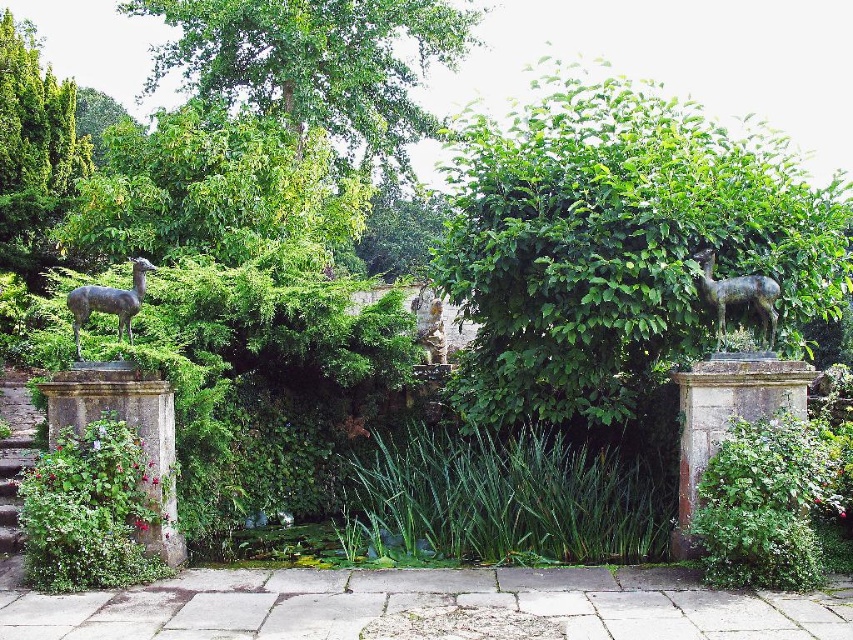
You are a gardener who needs to prune the green leafy tree at upper center and the bronze statue at left. Which object requires a taller ladder to reach its highest point?

The green leafy tree at upper center requires a taller ladder since it has a greater height compared to the bronze statue at left.

Consider the image. You are a gardener trying to place a new decorative item between the shiny bronze deer at right and the bronze statue at left. The item is 10 cm thick. Can you fit it between them based on their thickness?

The shiny bronze deer at right is thinner than the bronze statue at left, so the space between them may accommodate the 10 cm thick item. However, without knowing the exact distance between the statues, it is uncertain if there is enough space. The question only provides information about their thickness, not the distance separating them.